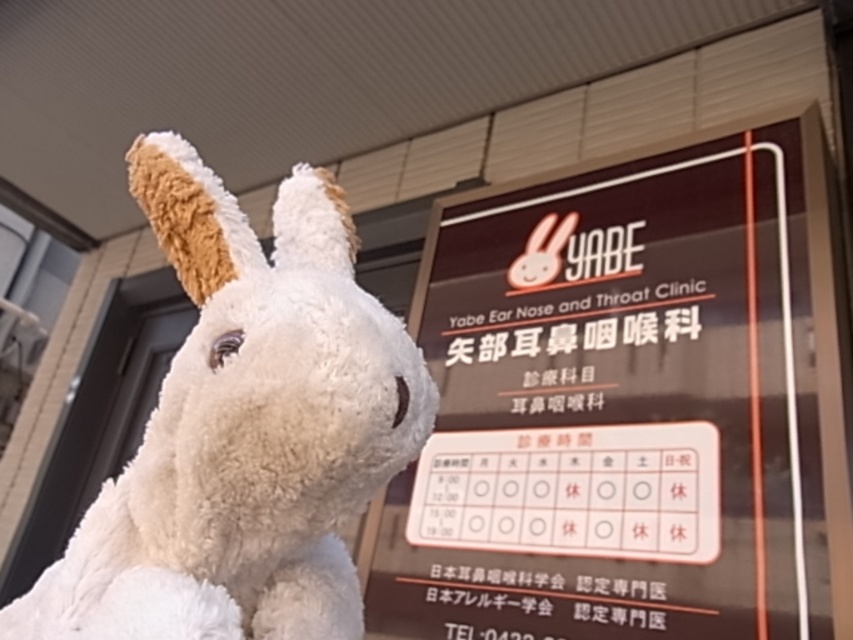
Question: Which point is farther to the camera?

Choices:
 (A) matte black signboard at upper center
 (B) white plush toy at left

Answer: (A)

Question: Which point is farther from the camera taking this photo?

Choices:
 (A) (412, 422)
 (B) (434, 374)

Answer: (B)

Question: Is matte black signboard at upper center wider than white plush toy at left?

Choices:
 (A) yes
 (B) no

Answer: (A)

Question: Does matte black signboard at upper center appear on the right side of white plush toy at left?

Choices:
 (A) no
 (B) yes

Answer: (B)

Question: Among these objects, which one is nearest to the camera?

Choices:
 (A) matte black signboard at upper center
 (B) white plush toy at left

Answer: (B)

Question: Considering the relative positions of matte black signboard at upper center and white plush toy at left in the image provided, where is matte black signboard at upper center located with respect to white plush toy at left?

Choices:
 (A) left
 (B) right

Answer: (B)